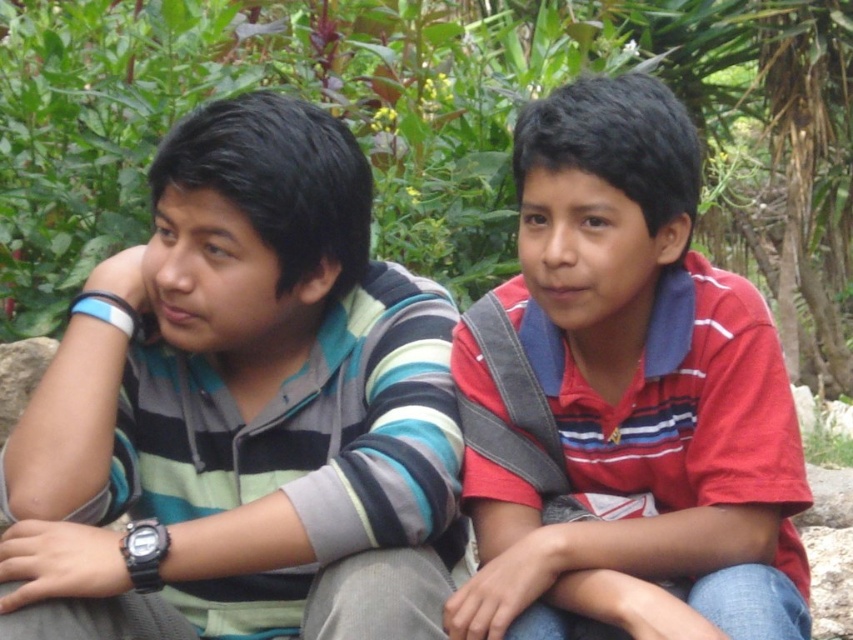
Question: Is striped cotton shirt at left to the left of gray stone at lower center from the viewer's perspective?

Choices:
 (A) yes
 (B) no

Answer: (A)

Question: Does striped cotton shirt at left appear under red striped shirt at center?

Choices:
 (A) yes
 (B) no

Answer: (B)

Question: Does red striped shirt at center come in front of gray stone at lower center?

Choices:
 (A) yes
 (B) no

Answer: (A)

Question: Considering the real-world distances, which object is farthest from the red striped shirt at center?

Choices:
 (A) gray rock at lower left
 (B) gray stone at lower right

Answer: (A)

Question: Which object is positioned closest to the striped cotton shirt at left?

Choices:
 (A) gray rock at lower left
 (B) gray stone at lower right

Answer: (A)

Question: Which is nearer to the red striped shirt at center?

Choices:
 (A) gray rock at lower left
 (B) gray stone at lower center

Answer: (A)